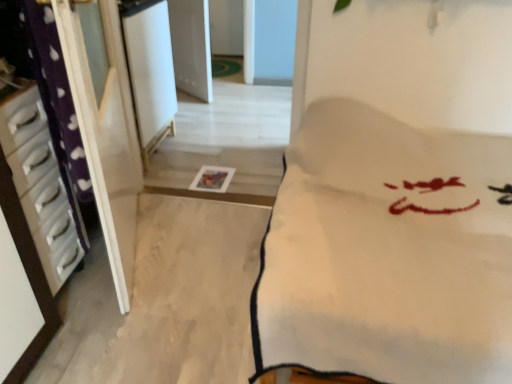
This screenshot has width=512, height=384. I want to click on spots to the right of white glossy drawer at left, which ranks as the 2th furniture in right-to-left order, so click(x=112, y=294).